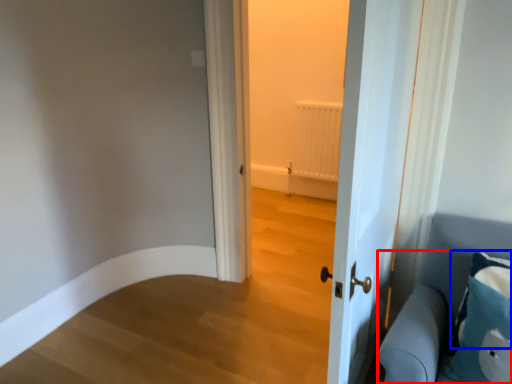
Question: Which object is further to the camera taking this photo, furniture (highlighted by a red box) or pillow (highlighted by a blue box)?

Choices:
 (A) furniture
 (B) pillow

Answer: (B)